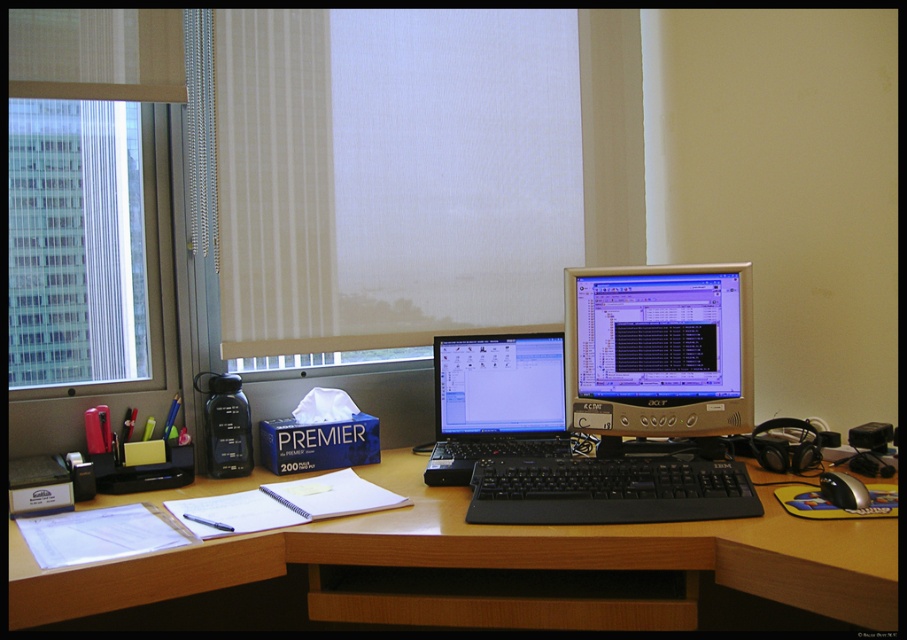
Question: Is silver metallic monitor at center to the right of black plastic keyboard at center from the viewer's perspective?

Choices:
 (A) yes
 (B) no

Answer: (A)

Question: Observing the image, what is the correct spatial positioning of beige fabric curtain at upper center in reference to black plastic keyboard at center?

Choices:
 (A) below
 (B) above

Answer: (B)

Question: Can you confirm if wooden at center is positioned to the right of transparent glass window at left?

Choices:
 (A) no
 (B) yes

Answer: (B)

Question: Which of the following is the farthest from the observer?

Choices:
 (A) black plastic laptop at center
 (B) silver metallic mouse at lower right
 (C) transparent glass window at left

Answer: (C)

Question: Estimate the real-world distances between objects in this image. Which object is farther from the black plastic keyboard at center?

Choices:
 (A) black plastic laptop at center
 (B) wooden at center

Answer: (A)

Question: Which object is the farthest from the black plastic keyboard at center?

Choices:
 (A) wooden at center
 (B) beige fabric curtain at upper center
 (C) silver metallic monitor at center

Answer: (B)